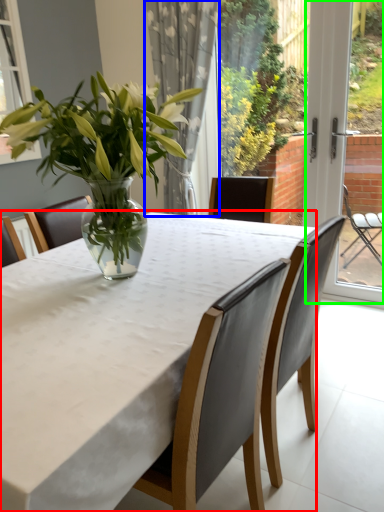
Question: Which is farther away from table (highlighted by a red box)? curtain (highlighted by a blue box) or screen door (highlighted by a green box)?

Choices:
 (A) curtain
 (B) screen door

Answer: (B)